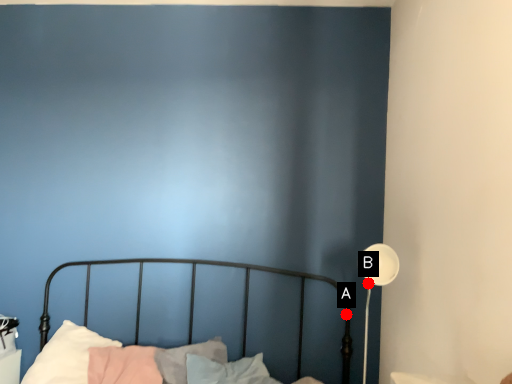
Question: Two points are circled on the image, labeled by A and B beside each circle. Which point is closer to the camera?

Choices:
 (A) A is closer
 (B) B is closer

Answer: (B)